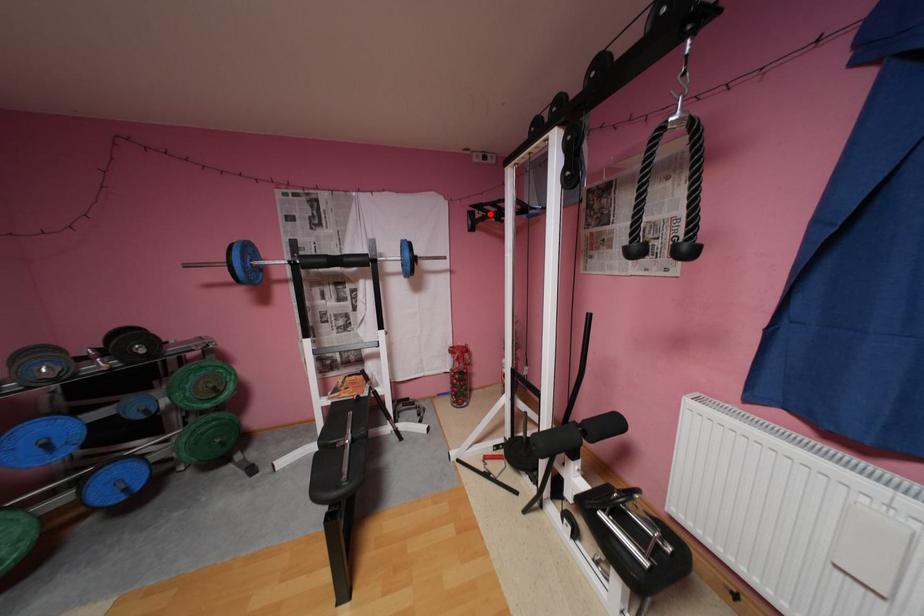
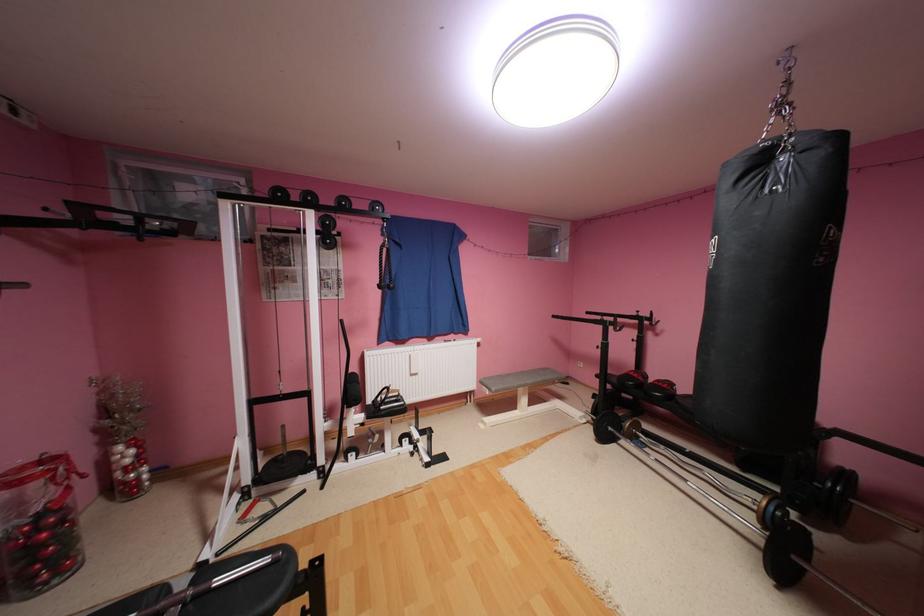
Find the pixel in the second image that matches the highlighted location in the first image.

(78, 216)